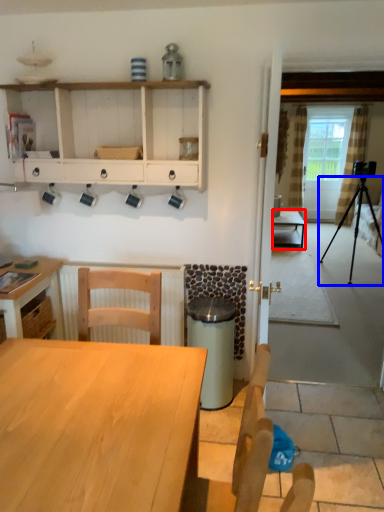
Question: Which point is further to the camera, table (highlighted by a red box) or tripod (highlighted by a blue box)?

Choices:
 (A) table
 (B) tripod

Answer: (A)